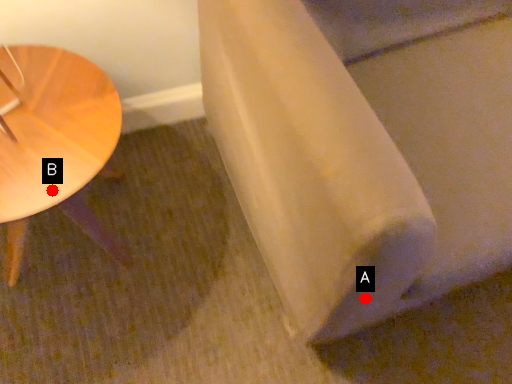
Question: Two points are circled on the image, labeled by A and B beside each circle. Which point appears closest to the camera in this image?

Choices:
 (A) A is closer
 (B) B is closer

Answer: (A)